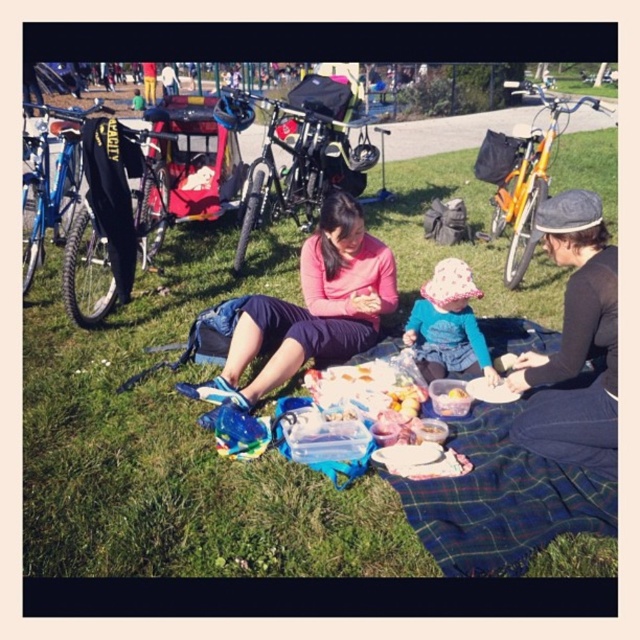
You are planning to place a small toy at point (573, 342) in the image. What object will be under the toy?

The dark gray knit hat at lower right is located at point (573, 342), so placing the toy there would result in the toy being placed on top of the dark gray knit hat at lower right.

You are planning to buy a gift for a baby. You have a choice between a pink matte sweater at center and a fluffy pink hat at center. If you want to choose the item that is bigger in size, which one should you pick?

The pink matte sweater at center is larger in size compared to the fluffy pink hat at center, so you should choose the pink matte sweater at center.